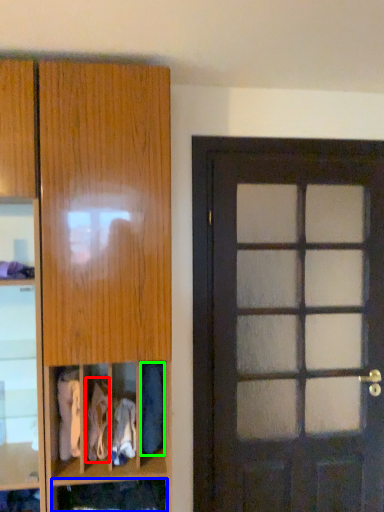
Question: Estimate the real-world distances between objects in this image. Which object is farther from clothing (highlighted by a red box), cabinet (highlighted by a blue box) or clothing (highlighted by a green box)?

Choices:
 (A) cabinet
 (B) clothing

Answer: (B)